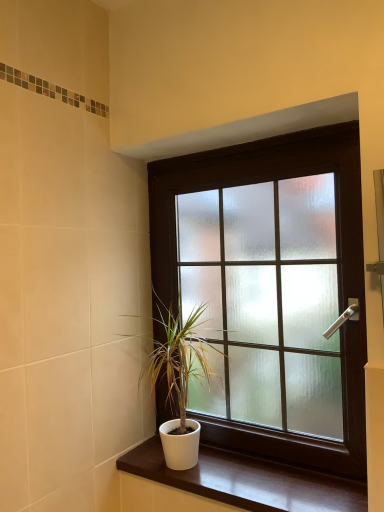
What are the coordinates of `free space between frosted glass window at center and white matte pot at lower center` in the screenshot? It's located at (268, 489).